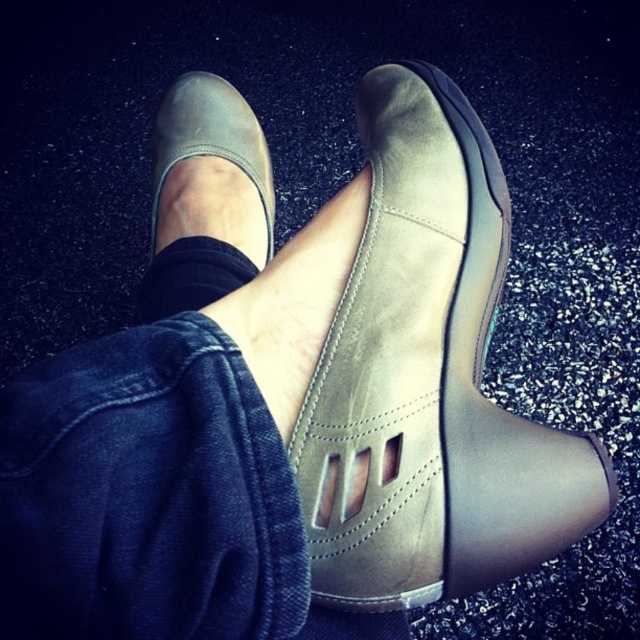
You are standing in front of the dark background and want to place a small pebble between the matte leather shoe at center and the black suede ankle at center. Based on their positions, which object should you place the pebble closer to?

The matte leather shoe at center is to the left of black suede ankle at center, so you should place the pebble closer to the matte leather shoe at center since it is positioned to the left side.

You are a photographer setting up a shot of the suede tan sandal at center. The camera is positioned to capture the sandal clearly. If you want to ensure the sandal fills the frame without cropping, what should you do?

The suede tan sandal at center is 31.84 centimeters from the camera. To ensure it fills the frame without cropping, move the camera closer to the sandal until it reaches the desired size in the frame.

You are trying to choose between two shoes displayed in a store window. The suede tan sandal at center and the matte leather shoe at center are both placed on a mannequin foot. If you want to know which one is wider, which one should you pick?

The suede tan sandal at center is wider than the matte leather shoe at center, so you should pick the suede tan sandal at center if you want a wider option.